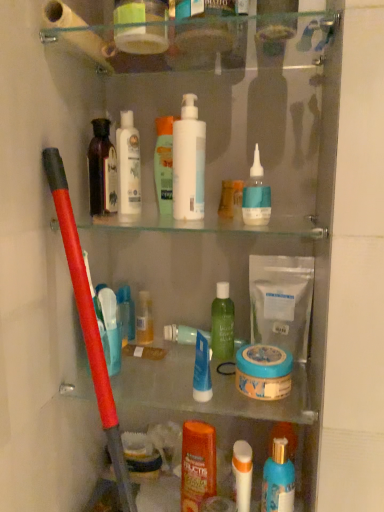
Image resolution: width=384 pixels, height=512 pixels. Describe the element at coordinates (76, 34) in the screenshot. I see `white matte toilet paper at upper left` at that location.

At what (x,y) coordinates should I click in order to perform the action: click on white matte bag at center, the first cleaning product in the right-to-left sequence. Please return your answer as a coordinate pair (x, y). Looking at the image, I should click on (281, 301).

The height and width of the screenshot is (512, 384). Describe the element at coordinates (242, 474) in the screenshot. I see `white matte tube at center, the 1th toiletry when ordered from bottom to top` at that location.

Identify the location of white matte tube at center, the 1th toiletry when ordered from bottom to top. Image resolution: width=384 pixels, height=512 pixels. (242, 474).

Identify the location of white matte toilet paper at upper left. (76, 34).

Which is in front, point (171, 198) or point (247, 466)?

The point (247, 466) is closer.

Based on the photo, from a real-world perspective, is translucent plastic pump bottle at center, which is counted as the 2th toiletry, starting from the top, on top of white matte tube at center, acting as the 8th toiletry starting from the top?

Yes, from a real-world perspective, translucent plastic pump bottle at center, which is counted as the 2th toiletry, starting from the top, is over white matte tube at center, acting as the 8th toiletry starting from the top

Looking at their sizes, would you say translucent plastic pump bottle at center, arranged as the seventh toiletry when ordered from the bottom, is wider or thinner than white matte tube at center, the 1th toiletry when ordered from bottom to top?

In the image, translucent plastic pump bottle at center, arranged as the seventh toiletry when ordered from the bottom, appears to be more narrow than white matte tube at center, the 1th toiletry when ordered from bottom to top.

Locate an element on the screen. Image resolution: width=384 pixels, height=512 pixels. the 6th toiletry above when counting from the white matte tube at center, acting as the 8th toiletry starting from the top (from the image's perspective) is located at coordinates (164, 164).

Could you measure the distance between translucent plastic pump bottle at center, arranged as the seventh toiletry when ordered from the bottom, and white matte toilet paper at upper left?

The distance of translucent plastic pump bottle at center, arranged as the seventh toiletry when ordered from the bottom, from white matte toilet paper at upper left is 8.98 inches.

Is point (172, 146) closer or farther from the camera than point (50, 42)?

Point (172, 146) is positioned farther from the camera compared to point (50, 42).

Is translucent plastic pump bottle at center, arranged as the seventh toiletry when ordered from the bottom, next to white matte toilet paper at upper left and touching it?

No, translucent plastic pump bottle at center, arranged as the seventh toiletry when ordered from the bottom, is not next to white matte toilet paper at upper left.

Is translucent plastic pump bottle at center, which is counted as the 2th toiletry, starting from the top, facing away from white matte toilet paper at upper left?

No, translucent plastic pump bottle at center, which is counted as the 2th toiletry, starting from the top,'s orientation is not away from white matte toilet paper at upper left.

Is blue matte bottle at upper right, the 2th cleaning product when ordered from right to left, at the back of white matte pump bottle at center, the 2th cleaning product positioned from the left?

white matte pump bottle at center, the 2th cleaning product positioned from the left, is not turned away from blue matte bottle at upper right, the 2th cleaning product when ordered from right to left.

Between white matte pump bottle at center, the 2th cleaning product positioned from the left, and blue matte bottle at upper right, the 2th cleaning product when ordered from right to left, which one has larger size?

Bigger between the two is white matte pump bottle at center, the 2th cleaning product positioned from the left.

Is point (191, 122) closer or farther from the camera than point (243, 210)?

Clearly, point (191, 122) is more distant from the camera than point (243, 210).

Can you confirm if translucent plastic bottle at center, which is the 4th toiletry in bottom-to-top order, is positioned to the left of blue matte tube at center, the sixth toiletry when ordered from top to bottom?

Indeed, translucent plastic bottle at center, which is the 4th toiletry in bottom-to-top order, is positioned on the left side of blue matte tube at center, the sixth toiletry when ordered from top to bottom.

Is point (137, 318) behind point (206, 350)?

Yes, point (137, 318) is farther from viewer.

Between translucent plastic bottle at center, which is the 4th toiletry in bottom-to-top order, and blue matte tube at center, the sixth toiletry when ordered from top to bottom, which one has larger size?

blue matte tube at center, the sixth toiletry when ordered from top to bottom, is bigger.

Is translucent plastic bottle at center, the fifth toiletry in the top-to-bottom sequence, touching blue matte tube at center, the sixth toiletry when ordered from top to bottom?

translucent plastic bottle at center, the fifth toiletry in the top-to-bottom sequence, is not next to blue matte tube at center, the sixth toiletry when ordered from top to bottom, and they're not touching.

Who is smaller, blue matte jar at center, positioned as the 1th mouthwash in top-to-bottom order, or translucent plastic pump bottle at center, arranged as the seventh toiletry when ordered from the bottom?

Smaller between the two is translucent plastic pump bottle at center, arranged as the seventh toiletry when ordered from the bottom.

Is blue matte jar at center, the second mouthwash from the bottom, behind translucent plastic pump bottle at center, which is counted as the 2th toiletry, starting from the top?

No, blue matte jar at center, the second mouthwash from the bottom, is closer to the camera.

Considering the relative positions of blue matte jar at center, positioned as the 1th mouthwash in top-to-bottom order, and translucent plastic pump bottle at center, which is counted as the 2th toiletry, starting from the top, in the image provided, is blue matte jar at center, positioned as the 1th mouthwash in top-to-bottom order, to the right of translucent plastic pump bottle at center, which is counted as the 2th toiletry, starting from the top, from the viewer's perspective?

Correct, you'll find blue matte jar at center, positioned as the 1th mouthwash in top-to-bottom order, to the right of translucent plastic pump bottle at center, which is counted as the 2th toiletry, starting from the top.

Considering the positions of points (156, 8) and (79, 25), is point (156, 8) closer to camera compared to point (79, 25)?

No, (156, 8) is further to viewer.

Considering the positions of objects translucent plastic container at upper center, marked as the eighth toiletry in a bottom-to-top arrangement, and white matte toilet paper at upper left in the image provided, who is more to the right, translucent plastic container at upper center, marked as the eighth toiletry in a bottom-to-top arrangement, or white matte toilet paper at upper left?

translucent plastic container at upper center, marked as the eighth toiletry in a bottom-to-top arrangement.

Find the location of a particular element. toilet paper below the translucent plastic container at upper center, marked as the eighth toiletry in a bottom-to-top arrangement (from a real-world perspective) is located at coordinates (76, 34).

Looking at this image, from a real-world perspective, between translucent plastic container at upper center, which is the first toiletry in top-to-bottom order, and white matte toilet paper at upper left, who is vertically lower?

white matte toilet paper at upper left.

Based on the photo, is orange matte shampoo at center, the seventh toiletry viewed from the top, in contact with blue glossy mouthwash at lower right, which is the 1th mouthwash in bottom-to-top order?

orange matte shampoo at center, the seventh toiletry viewed from the top, and blue glossy mouthwash at lower right, which is the 1th mouthwash in bottom-to-top order, are clearly separated.

Looking at this image, considering the sizes of orange matte shampoo at center, acting as the 2th toiletry starting from the bottom, and blue glossy mouthwash at lower right, acting as the 2th mouthwash starting from the top, in the image, is orange matte shampoo at center, acting as the 2th toiletry starting from the bottom, bigger or smaller than blue glossy mouthwash at lower right, acting as the 2th mouthwash starting from the top,?

Considering their sizes, orange matte shampoo at center, acting as the 2th toiletry starting from the bottom, takes up less space than blue glossy mouthwash at lower right, acting as the 2th mouthwash starting from the top.

Which is less distant, (197, 450) or (282, 455)?

→ Positioned in front is point (282, 455).

From a real-world perspective, is orange matte shampoo at center, acting as the 2th toiletry starting from the bottom, positioned above or below blue glossy mouthwash at lower right, which is the 1th mouthwash in bottom-to-top order?

orange matte shampoo at center, acting as the 2th toiletry starting from the bottom, is below blue glossy mouthwash at lower right, which is the 1th mouthwash in bottom-to-top order.

You are a GUI agent. You are given a task and a screenshot of the screen. Output one action in this format:
    pyautogui.click(x=<x>, y=<y>)
    Task: Click on the 6th toiletry above when counting from the white matte tube at center, the 1th toiletry when ordered from bottom to top (from the image's perspective)
    The width and height of the screenshot is (384, 512).
    Given the screenshot: What is the action you would take?
    pyautogui.click(x=164, y=164)

The image size is (384, 512). I want to click on toilet paper on the left of translucent plastic pump bottle at center, arranged as the seventh toiletry when ordered from the bottom, so click(x=76, y=34).

Looking at the image, which one is located further to white matte toilet paper at upper left, green matte bottle at center, which is counted as the fourth toiletry, starting from the top, or orange matte shampoo at center, the seventh toiletry viewed from the top?

Based on the image, orange matte shampoo at center, the seventh toiletry viewed from the top, appears to be further to white matte toilet paper at upper left.

Based on their spatial positions, is translucent plastic bottle at center, which is the 4th toiletry in bottom-to-top order, or blue glossy mouthwash at lower right, which is the 1th mouthwash in bottom-to-top order, further from blue matte jar at center, the second mouthwash from the bottom?

translucent plastic bottle at center, which is the 4th toiletry in bottom-to-top order, is positioned further to the anchor blue matte jar at center, the second mouthwash from the bottom.

In the scene shown: From the image, which object appears to be nearer to white matte lotion at center, the fourth cleaning product positioned from the right, blue matte jar at center, the second mouthwash from the bottom, or orange matte shampoo at center, acting as the 2th toiletry starting from the bottom?

Among the two, blue matte jar at center, the second mouthwash from the bottom, is located nearer to white matte lotion at center, the fourth cleaning product positioned from the right.

When comparing their distances from translucent plastic pump bottle at center, which is counted as the 2th toiletry, starting from the top, does blue glossy mouthwash at lower right, acting as the 2th mouthwash starting from the top, or white matte pump bottle at center, the 2th cleaning product positioned from the left, seem closer?

white matte pump bottle at center, the 2th cleaning product positioned from the left, is positioned closer to the anchor translucent plastic pump bottle at center, which is counted as the 2th toiletry, starting from the top.

Which object lies further to the anchor point dark brown glass bottle at upper left, placed as the sixth toiletry when sorted from bottom to top, white matte lotion at center, which ranks as the first cleaning product in left-to-right order, or white matte pump bottle at center, the 2th cleaning product positioned from the left?

Among the two, white matte pump bottle at center, the 2th cleaning product positioned from the left, is located further to dark brown glass bottle at upper left, placed as the sixth toiletry when sorted from bottom to top.

Estimate the real-world distances between objects in this image. Which object is closer to translucent plastic bottle at center, the fifth toiletry in the top-to-bottom sequence, white matte toilet paper at upper left or orange matte shampoo at center, the seventh toiletry viewed from the top?

orange matte shampoo at center, the seventh toiletry viewed from the top, lies closer to translucent plastic bottle at center, the fifth toiletry in the top-to-bottom sequence, than the other object.

Based on their spatial positions, is blue matte bottle at upper right, the 2th cleaning product when ordered from right to left, or white matte tube at center, the 1th toiletry when ordered from bottom to top, further from translucent plastic pump bottle at center, which is counted as the 2th toiletry, starting from the top?

white matte tube at center, the 1th toiletry when ordered from bottom to top, lies further to translucent plastic pump bottle at center, which is counted as the 2th toiletry, starting from the top, than the other object.

Based on their spatial positions, is white matte lotion at center, which ranks as the first cleaning product in left-to-right order, or white matte pump bottle at center, which is the 3th cleaning product from right to left, further from white matte toilet paper at upper left?

white matte pump bottle at center, which is the 3th cleaning product from right to left, is positioned further to the anchor white matte toilet paper at upper left.

At what (x,y) coordinates should I click in order to perform the action: click on toiletry between translucent plastic bottle at center, which is the 4th toiletry in bottom-to-top order, and orange matte shampoo at center, acting as the 2th toiletry starting from the bottom, in the vertical direction. Please return your answer as a coordinate pair (x, y). This screenshot has height=512, width=384. Looking at the image, I should click on (202, 370).

Identify the location of toiletry between dark brown glass bottle at upper left, which is the third toiletry in top-to-bottom order, and translucent plastic bottle at center, the fifth toiletry in the top-to-bottom sequence, vertically. (222, 323).

Image resolution: width=384 pixels, height=512 pixels. I want to click on cleaning product between blue matte bottle at upper right, the 2th cleaning product when ordered from right to left, and green matte bottle at center, which ranks as the fifth toiletry in bottom-to-top order, in the vertical direction, so click(281, 301).

Where is `toiletry that lies between white matte toilet paper at upper left and white matte pump bottle at center, which is the 3th cleaning product from right to left, from top to bottom`? This screenshot has width=384, height=512. toiletry that lies between white matte toilet paper at upper left and white matte pump bottle at center, which is the 3th cleaning product from right to left, from top to bottom is located at coordinates (164, 164).